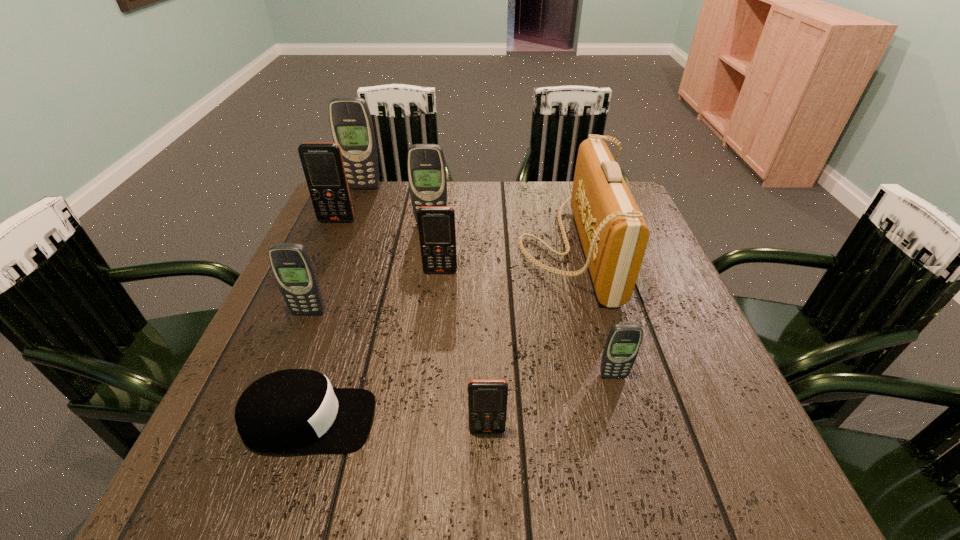
In the image, there is a desktop. Where is `vacant space at the near right corner`? The image size is (960, 540). vacant space at the near right corner is located at coordinates (728, 453).

You are a GUI agent. You are given a task and a screenshot of the screen. Output one action in this format:
    pyautogui.click(x=<x>, y=<y>)
    Task: Click on the empty space that is in between the handbag and the cap
    The height and width of the screenshot is (540, 960).
    Given the screenshot: What is the action you would take?
    pyautogui.click(x=440, y=334)

At what (x,y) coordinates should I click in order to perform the action: click on vacant space that is in between the shortest object and the second biggest orange cellular telephone. Please return your answer as a coordinate pair (x, y). This screenshot has width=960, height=540. Looking at the image, I should click on (374, 346).

Image resolution: width=960 pixels, height=540 pixels. Identify the location of free space between the second farthest orange cellular telephone and the handbag. tap(505, 260).

This screenshot has height=540, width=960. I want to click on unoccupied area between the second smallest gray cellular telephone and the third nearest gray cellular telephone, so click(370, 268).

The width and height of the screenshot is (960, 540). Identify the location of vacant space in between the fifth farthest cellular telephone and the leftmost orange cellular telephone. (323, 267).

This screenshot has width=960, height=540. What are the coordinates of `vacant area that lies between the second cellular telephone from right to left and the cap` in the screenshot? It's located at (397, 426).

I want to click on unoccupied area between the farthest orange cellular telephone and the black cap, so click(x=323, y=321).

The image size is (960, 540). I want to click on free point between the farthest gray cellular telephone and the second cellular telephone from right to left, so click(x=425, y=309).

I want to click on free point between the rightmost orange cellular telephone and the rightmost cellular telephone, so click(x=550, y=403).